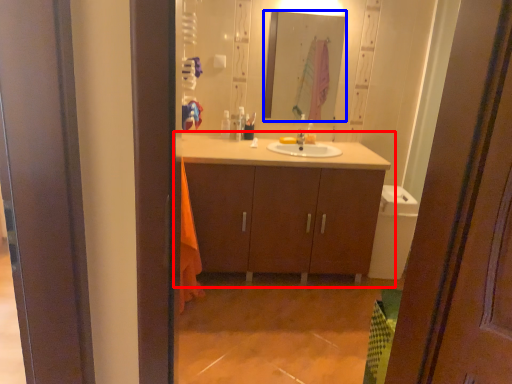
Question: Which of the following is the closest to the observer, bathroom cabinet (highlighted by a red box) or mirror (highlighted by a blue box)?

Choices:
 (A) bathroom cabinet
 (B) mirror

Answer: (A)